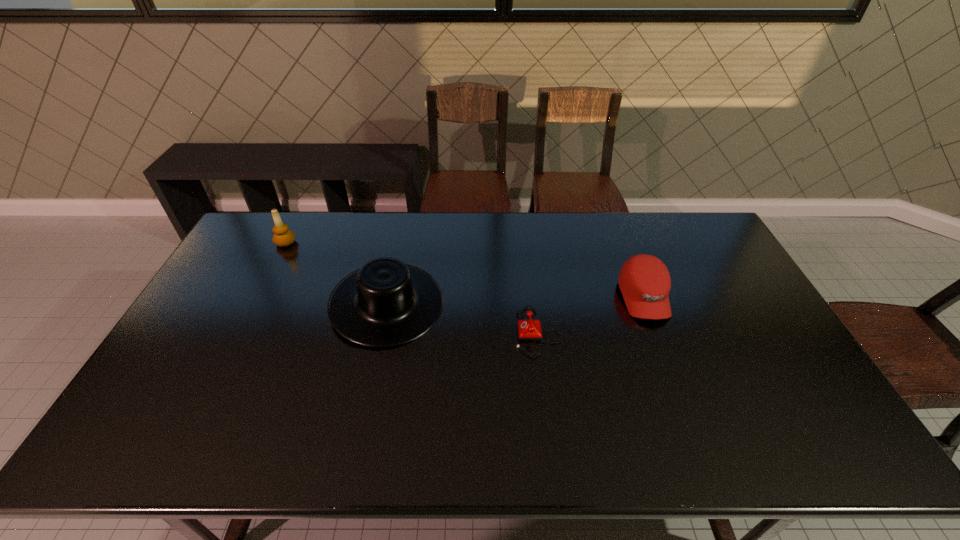
Where is `candle_holder`? candle_holder is located at coordinates (283, 237).

Where is `the leftmost object`? the leftmost object is located at coordinates (283, 237).

Identify the location of dress hat. (385, 303).

I want to click on the second shortest object, so click(x=644, y=280).

At what (x,y) coordinates should I click in order to perform the action: click on cap. Please return your answer as a coordinate pair (x, y). This screenshot has height=540, width=960. Looking at the image, I should click on (644, 280).

At what (x,y) coordinates should I click in order to perform the action: click on the shortest object. Please return your answer as a coordinate pair (x, y). This screenshot has height=540, width=960. Looking at the image, I should click on (529, 329).

Where is `the second object from right to left`? The width and height of the screenshot is (960, 540). the second object from right to left is located at coordinates (529, 329).

Identify the location of vacant space situated 0.310m on the right of the candle_holder. (383, 242).

This screenshot has width=960, height=540. Find the location of `vacant space located on the back of the third object from right to left`. vacant space located on the back of the third object from right to left is located at coordinates (398, 249).

This screenshot has height=540, width=960. I want to click on vacant space located on the front-facing side of the cap, so click(675, 380).